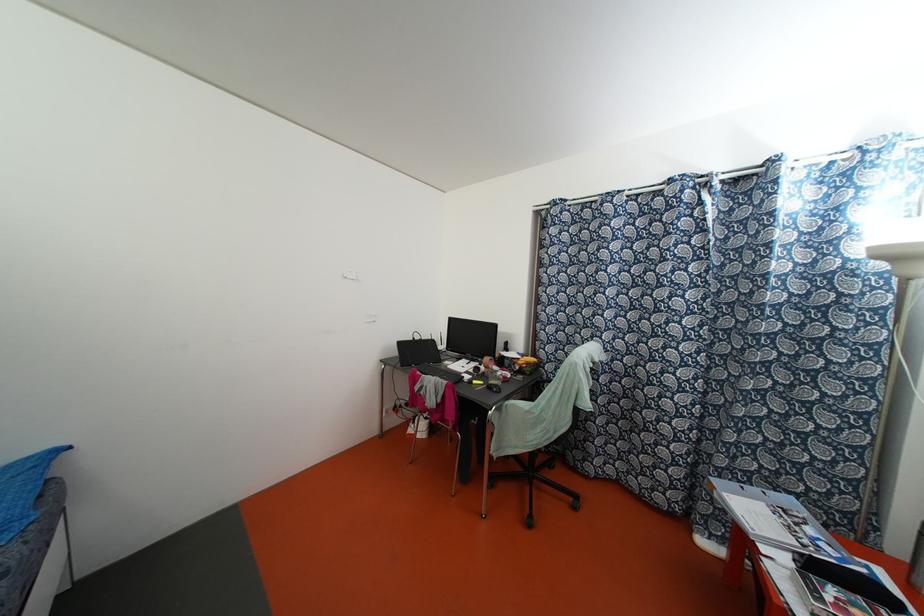
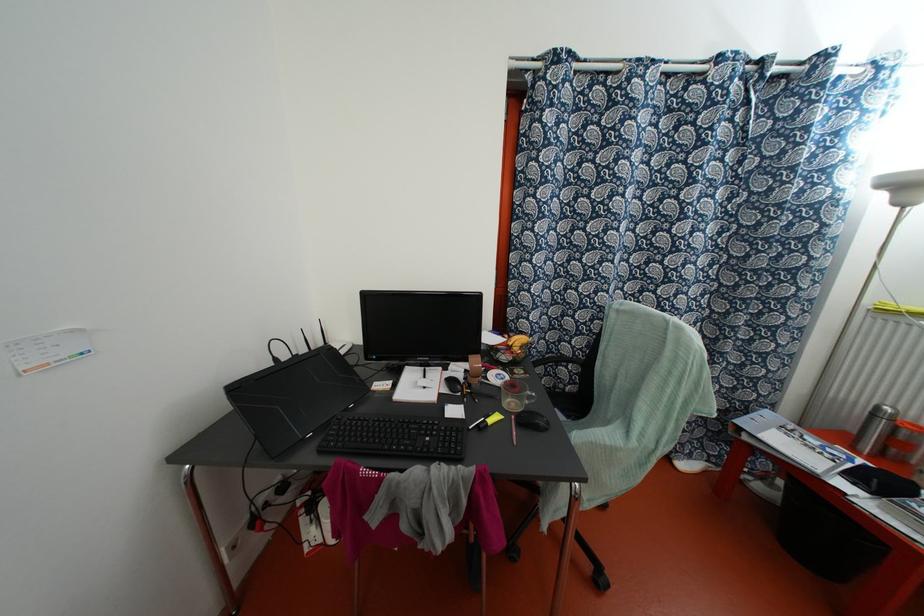
Where in the second image is the point corresponding to point 459,365 from the first image?

(418, 386)